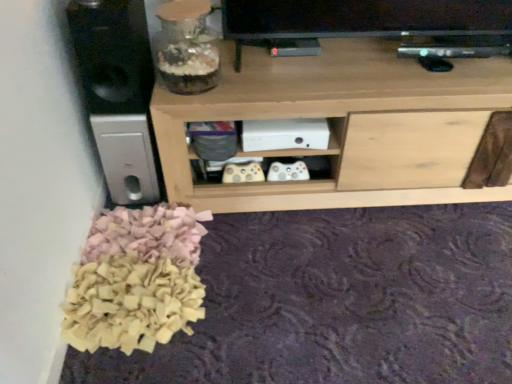
Question: In the image, is natural wood shelf at center positioned in front of or behind black matte speaker at left?

Choices:
 (A) behind
 (B) front

Answer: (A)

Question: Would you say natural wood shelf at center is to the left or to the right of black matte speaker at left in the picture?

Choices:
 (A) left
 (B) right

Answer: (B)

Question: Which of these objects is positioned closest to the translucent glass jar at upper left?

Choices:
 (A) black matte speaker at left
 (B) natural wood shelf at center

Answer: (A)

Question: Which is nearer to the translucent glass jar at upper left?

Choices:
 (A) natural wood shelf at center
 (B) black matte speaker at left

Answer: (B)